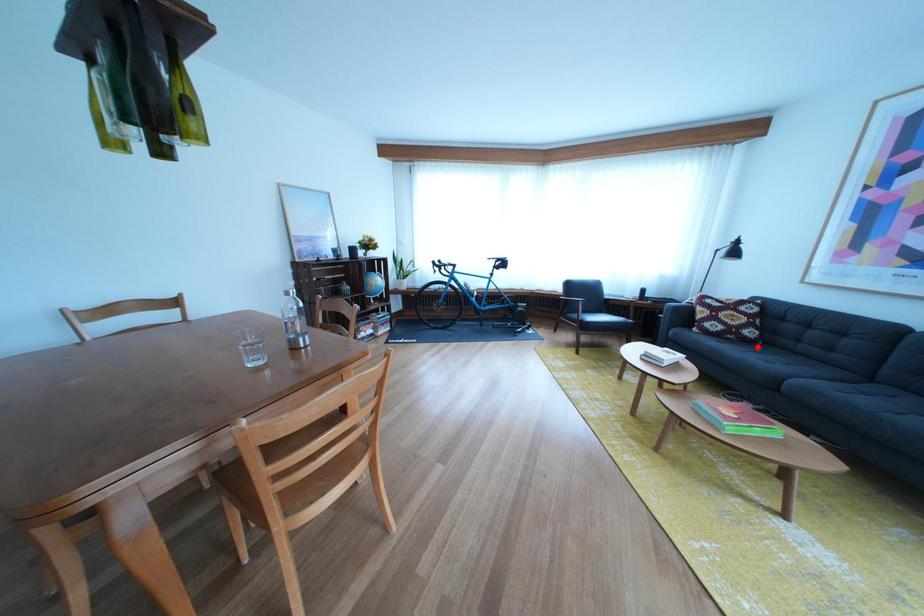
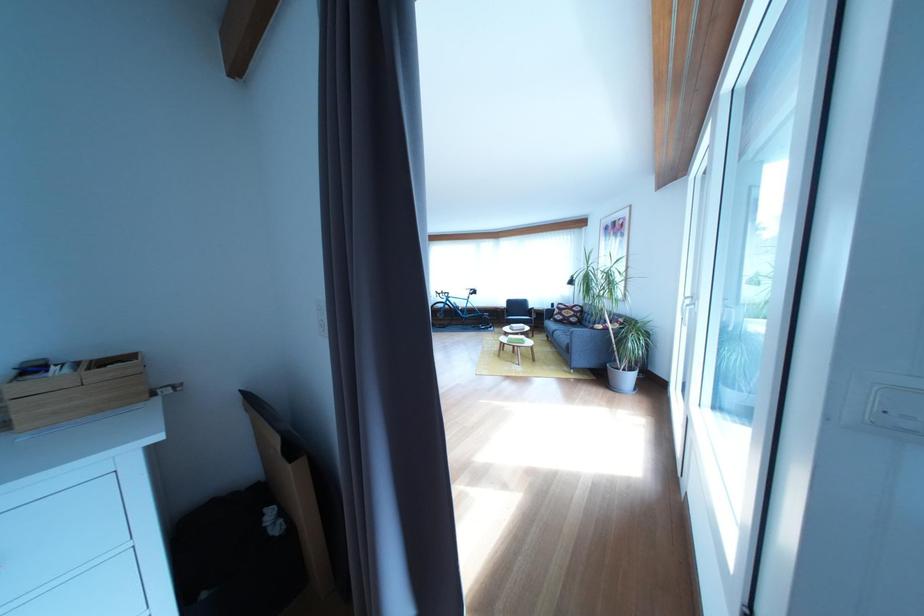
Locate, in the second image, the point that corresponds to the highlighted location in the first image.

(585, 330)